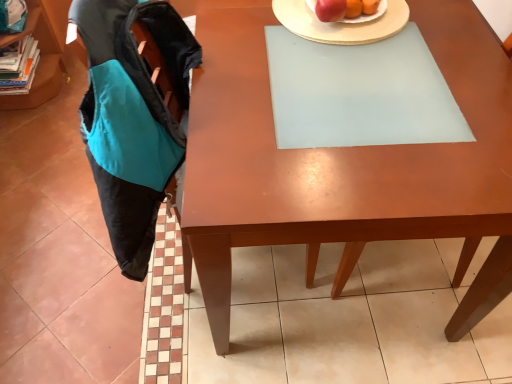
Question: Based on their positions, is teal fabric book at left located to the left or right of teal fabric shelf at upper left?

Choices:
 (A) right
 (B) left

Answer: (A)

Question: Looking at their shapes, would you say teal fabric book at left is wider or thinner than teal fabric shelf at upper left?

Choices:
 (A) wide
 (B) thin

Answer: (B)

Question: Based on their relative distances, which object is farther from the teal fabric shelf at upper left?

Choices:
 (A) shiny red apple at upper center
 (B) teal fabric book at left
 (C) matte wooden desk at center
 (D) red matte apple at upper center
 (E) black fabric swivel chair at left

Answer: (D)

Question: Estimate the real-world distances between objects in this image. Which object is farther from the white ceramic plate at upper center?

Choices:
 (A) teal fabric shelf at upper left
 (B) red matte apple at upper center
 (C) matte wooden desk at center
 (D) shiny red apple at upper center
 (E) black fabric swivel chair at left

Answer: (A)